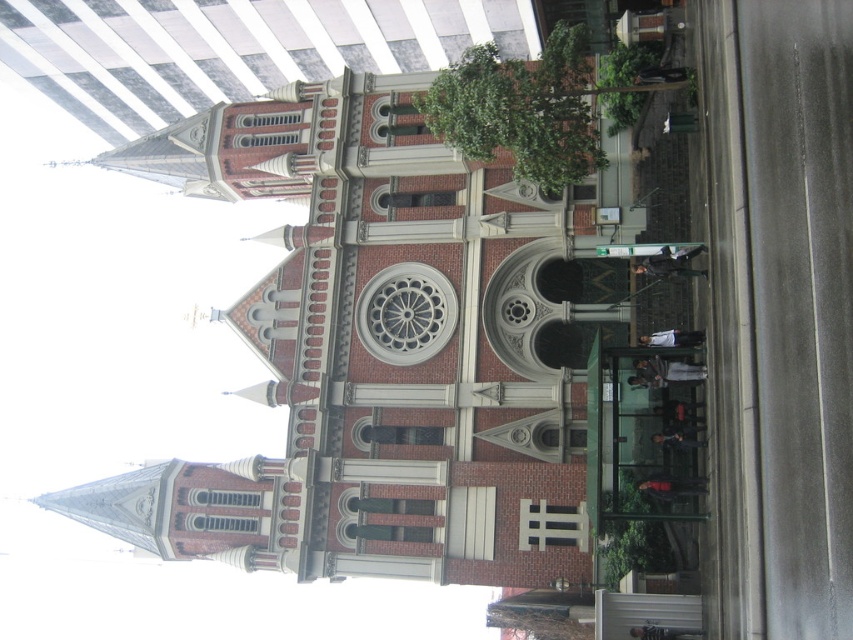
Question: Which point is closer to the camera?

Choices:
 (A) (630, 92)
 (B) (357, 515)
 (C) (517, 68)
 (D) (625, 552)

Answer: (D)

Question: Can you confirm if red brick church at center is positioned below green leafy tree at center?

Choices:
 (A) no
 (B) yes

Answer: (B)

Question: Among these points, which one is farthest from the camera?

Choices:
 (A) (500, 115)
 (B) (630, 474)
 (C) (263, 520)

Answer: (C)

Question: Does green leafy tree at center appear on the left side of green leafy plant at lower right?

Choices:
 (A) yes
 (B) no

Answer: (A)

Question: Is green leafy tree at center wider than green leafy plant at lower right?

Choices:
 (A) yes
 (B) no

Answer: (A)

Question: Which object is the farthest from the green leafy plant at lower right?

Choices:
 (A) red brick church at center
 (B) green leafy plant at upper center
 (C) green leafy tree at center

Answer: (B)